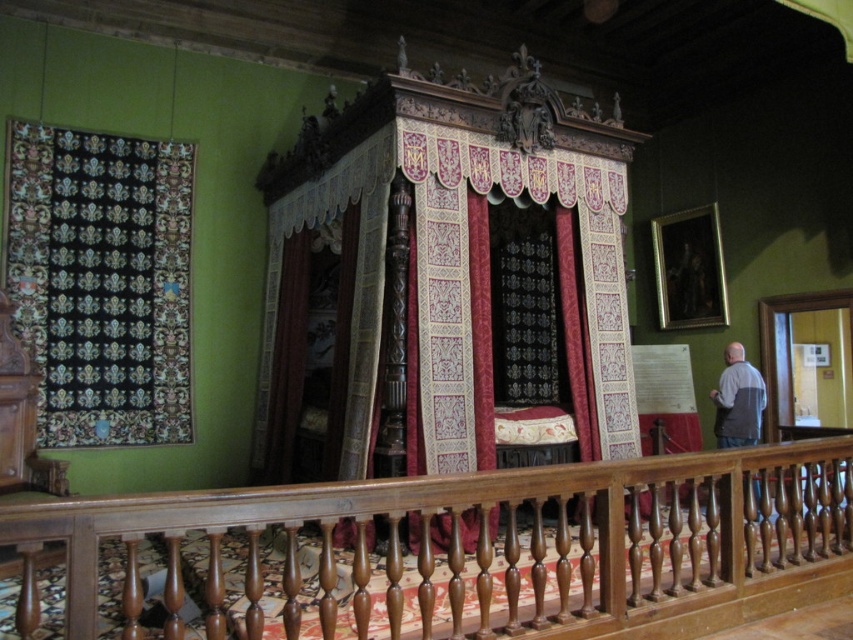
Question: Which object appears closest to the camera in this image?

Choices:
 (A) gray fabric apron at right
 (B) wooden balustrade at center
 (C) black velvet tapestry at left

Answer: (B)

Question: Can you confirm if velvet tapestry bed at center is positioned above gray fabric apron at right?

Choices:
 (A) yes
 (B) no

Answer: (A)

Question: Which object is the closest to the velvet tapestry bed at center?

Choices:
 (A) gray fabric apron at right
 (B) black velvet tapestry at left

Answer: (B)

Question: Is wooden balustrade at center behind gray fabric apron at right?

Choices:
 (A) no
 (B) yes

Answer: (A)

Question: Among these objects, which one is farthest from the camera?

Choices:
 (A) black velvet tapestry at left
 (B) gray fabric apron at right

Answer: (B)

Question: Is black velvet tapestry at left bigger than gray fabric apron at right?

Choices:
 (A) no
 (B) yes

Answer: (B)